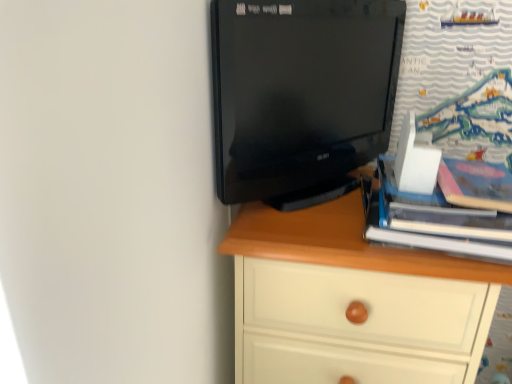
Question: From a real-world perspective, is black glossy monitor at upper center over hardcover book at right?

Choices:
 (A) yes
 (B) no

Answer: (A)

Question: Can you confirm if black glossy monitor at upper center is positioned to the left of hardcover book at right?

Choices:
 (A) yes
 (B) no

Answer: (A)

Question: Is black glossy monitor at upper center smaller than hardcover book at right?

Choices:
 (A) yes
 (B) no

Answer: (B)

Question: Is black glossy monitor at upper center shorter than hardcover book at right?

Choices:
 (A) yes
 (B) no

Answer: (B)

Question: From a real-world perspective, is black glossy monitor at upper center located beneath hardcover book at right?

Choices:
 (A) no
 (B) yes

Answer: (A)

Question: From the image's perspective, is white wood chest of drawers at center located above or below black glossy monitor at upper center?

Choices:
 (A) below
 (B) above

Answer: (A)

Question: Does point (351, 344) appear closer or farther from the camera than point (233, 69)?

Choices:
 (A) closer
 (B) farther

Answer: (B)

Question: Considering their positions, is white wood chest of drawers at center located in front of or behind black glossy monitor at upper center?

Choices:
 (A) front
 (B) behind

Answer: (B)

Question: In terms of width, does white wood chest of drawers at center look wider or thinner when compared to black glossy monitor at upper center?

Choices:
 (A) wide
 (B) thin

Answer: (A)

Question: Is white wood chest of drawers at center situated inside hardcover book at right or outside?

Choices:
 (A) outside
 (B) inside

Answer: (A)

Question: In the image, is white wood chest of drawers at center on the left side or the right side of hardcover book at right?

Choices:
 (A) right
 (B) left

Answer: (B)

Question: Is white wood chest of drawers at center taller or shorter than hardcover book at right?

Choices:
 (A) short
 (B) tall

Answer: (B)

Question: Considering the positions of white wood chest of drawers at center and hardcover book at right in the image, is white wood chest of drawers at center wider or thinner than hardcover book at right?

Choices:
 (A) wide
 (B) thin

Answer: (A)

Question: Which is correct: black glossy monitor at upper center is inside hardcover book at right, or outside of it?

Choices:
 (A) outside
 (B) inside

Answer: (A)

Question: Considering the relative positions of black glossy monitor at upper center and hardcover book at right in the image provided, is black glossy monitor at upper center to the left or to the right of hardcover book at right?

Choices:
 (A) left
 (B) right

Answer: (A)